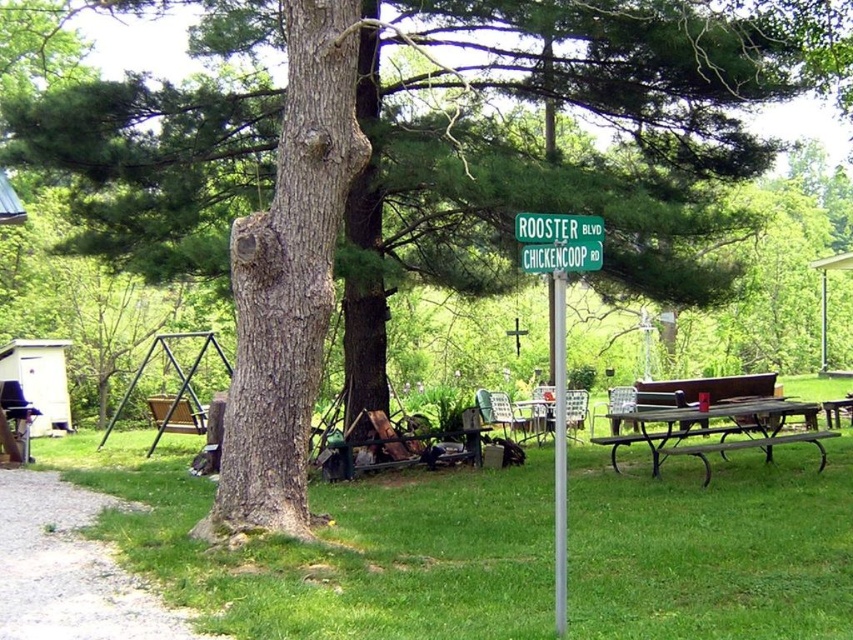
Question: Which is farther from the brown wooden bench at lower right?

Choices:
 (A) green grass at lower left
 (B) green metallic street sign at center
 (C) silver metallic pole at center

Answer: (B)

Question: Is green grass at lower left above brown wooden bench at lower right?

Choices:
 (A) no
 (B) yes

Answer: (A)

Question: Which of the following is the farthest from the observer?

Choices:
 (A) (560, 627)
 (B) (560, 289)

Answer: (B)

Question: Is metallic brown picnic table at center bigger than silver metallic pole at center?

Choices:
 (A) yes
 (B) no

Answer: (B)

Question: Is metallic brown picnic table at center below brown wooden bench at lower right?

Choices:
 (A) yes
 (B) no

Answer: (B)

Question: Which point appears closest to the camera in this image?

Choices:
 (A) (543, 241)
 (B) (704, 480)
 (C) (779, 426)

Answer: (A)